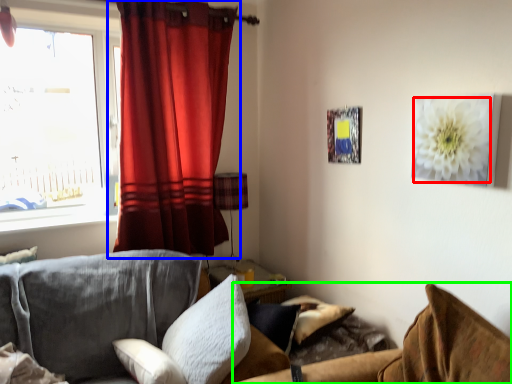
Question: Which object is positioned farthest from flower (highlighted by a red box)? Select from curtain (highlighted by a blue box) and couch (highlighted by a green box).

Choices:
 (A) curtain
 (B) couch

Answer: (A)